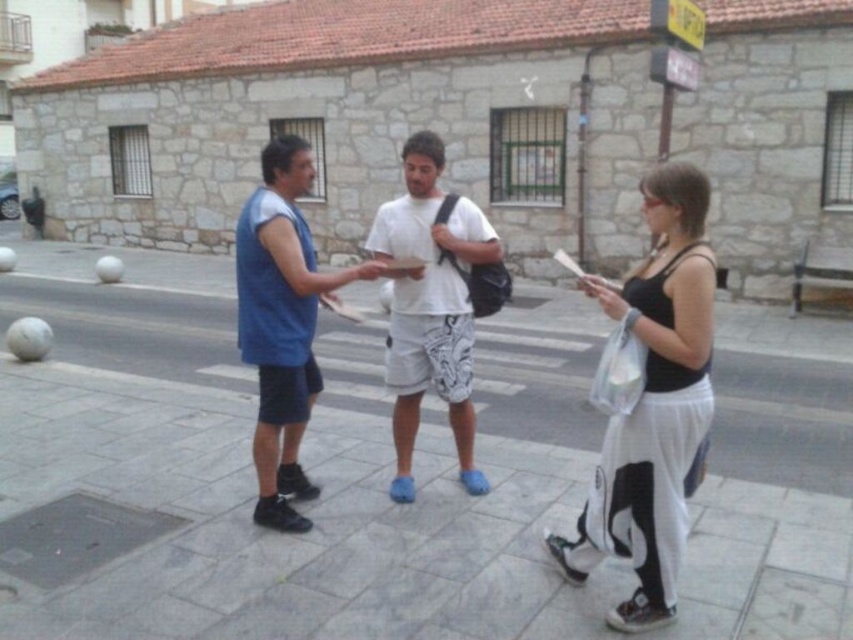
Question: Which object is closer to the camera taking this photo?

Choices:
 (A) gray stone pavement at center
 (B) white cotton t-shirt at center

Answer: (A)

Question: Does black tank top at center have a larger size compared to white cotton t-shirt at center?

Choices:
 (A) no
 (B) yes

Answer: (A)

Question: Does gray stone pavement at center appear on the right side of white cotton t-shirt at center?

Choices:
 (A) no
 (B) yes

Answer: (A)

Question: Is black tank top at center wider than blue fabric shirt at center?

Choices:
 (A) yes
 (B) no

Answer: (B)

Question: Based on their relative distances, which object is nearer to the black tank top at center?

Choices:
 (A) white cotton t-shirt at center
 (B) gray stone pavement at center

Answer: (A)

Question: Which is farther from the blue fabric shirt at center?

Choices:
 (A) white cotton t-shirt at center
 (B) gray stone pavement at center

Answer: (B)